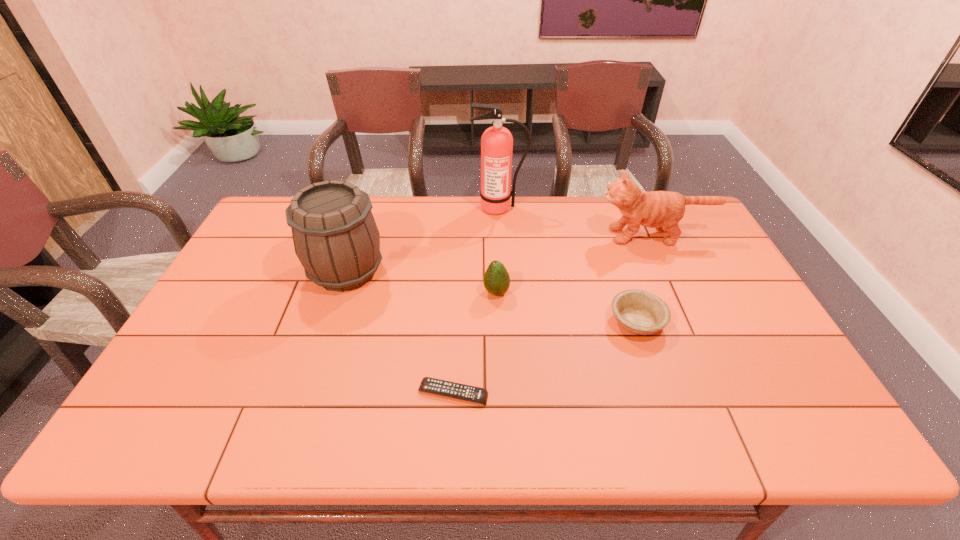
You are a GUI agent. You are given a task and a screenshot of the screen. Output one action in this format:
    pyautogui.click(x=<x>, y=<y>)
    Task: Click on the free space that is in between the leftmost object and the shortest object
    The image size is (960, 540).
    Given the screenshot: What is the action you would take?
    pyautogui.click(x=399, y=332)

Image resolution: width=960 pixels, height=540 pixels. What are the coordinates of `empty location between the wine bucket and the bowl` in the screenshot? It's located at (492, 296).

You are a GUI agent. You are given a task and a screenshot of the screen. Output one action in this format:
    pyautogui.click(x=<x>, y=<y>)
    Task: Click on the vacant region between the tallest object and the cat
    This screenshot has width=960, height=540.
    Given the screenshot: What is the action you would take?
    pyautogui.click(x=576, y=222)

Locate an element on the screen. The width and height of the screenshot is (960, 540). vacant region between the bowl and the cat is located at coordinates (645, 279).

Find the location of a particular element. free space that is in between the wine bucket and the shortest object is located at coordinates (399, 332).

Locate an element on the screen. free space between the third shortest object and the cat is located at coordinates (575, 264).

Find the location of a particular element. the fourth closest object relative to the fourth tallest object is located at coordinates (496, 142).

The height and width of the screenshot is (540, 960). In order to click on object that is the closest to the bowl in this screenshot , I will do `click(663, 210)`.

The image size is (960, 540). I want to click on vacant area that satisfies the following two spatial constraints: 1. on the front side of the wine bucket; 2. on the left side of the avocado, so click(339, 293).

Identify the location of blank area in the image that satisfies the following two spatial constraints: 1. on the front side of the leftmost object; 2. on the left side of the fifth tallest object. The width and height of the screenshot is (960, 540). (329, 321).